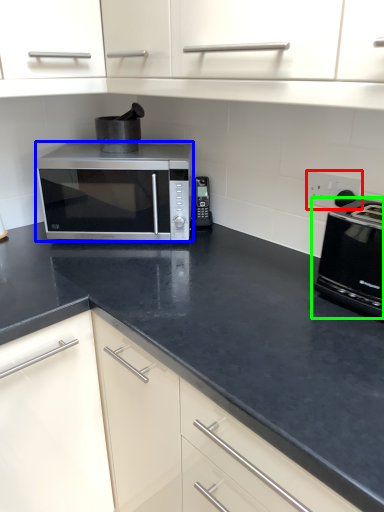
Question: Which object is the closest to the electric outlet (highlighted by a red box)? Choose among these: microwave oven (highlighted by a blue box) or toaster (highlighted by a green box).

Choices:
 (A) microwave oven
 (B) toaster

Answer: (B)